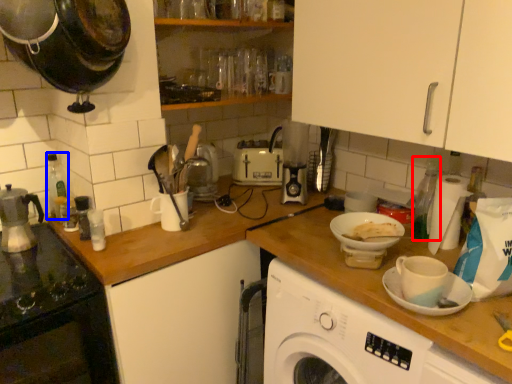
Question: Which object appears closest to the camera in this image, bottle (highlighted by a red box) or bottle (highlighted by a blue box)?

Choices:
 (A) bottle
 (B) bottle

Answer: (A)